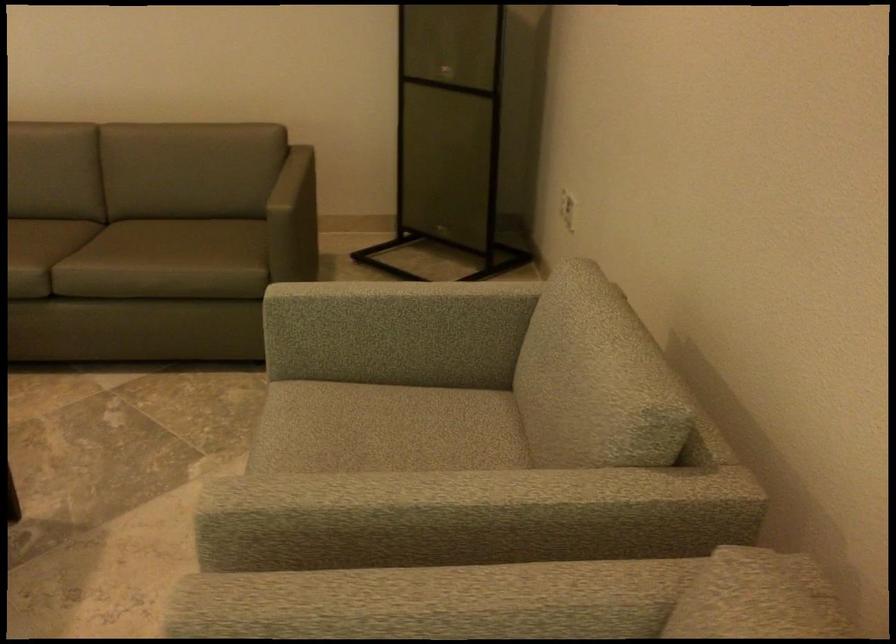
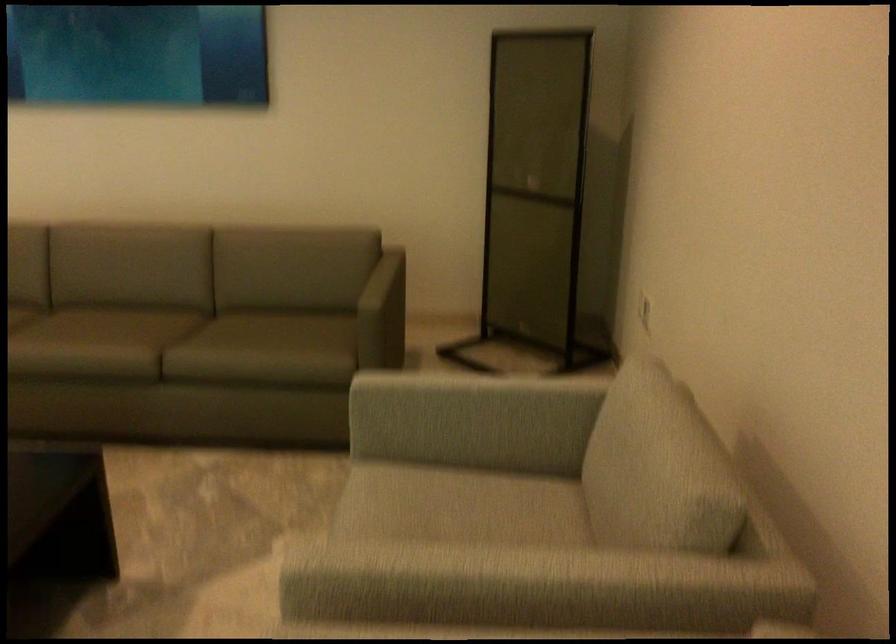
Question: Which direction would the cameraman need to move to produce the second image? Reply with the corresponding letter.

Choices:
 (A) Left
 (B) Right
 (C) Forward
 (D) Backward

Answer: (D)